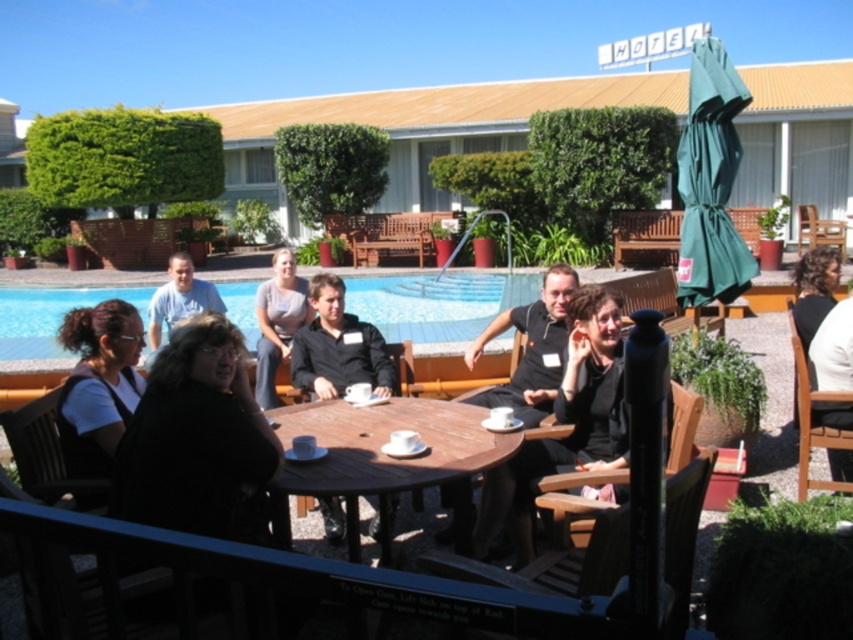
Which is more to the right, blue glass swimming pool at center or gray cotton shirt at center?

gray cotton shirt at center

Does blue glass swimming pool at center have a smaller size compared to gray cotton shirt at center?

No.

Describe the element at coordinates (436, 301) in the screenshot. The image size is (853, 640). I see `blue glass swimming pool at center` at that location.

Identify the location of blue glass swimming pool at center. (436, 301).

Can you confirm if wooden table at center is positioned to the right of matte blue shirt at upper left?

Correct, you'll find wooden table at center to the right of matte blue shirt at upper left.

Is wooden table at center bigger than matte blue shirt at upper left?

Yes.

This screenshot has width=853, height=640. I want to click on wooden table at center, so click(386, 460).

Is dark brown sweater at lower left below blue glass swimming pool at center?

Yes.

Where is `dark brown sweater at lower left`? dark brown sweater at lower left is located at coordinates (196, 440).